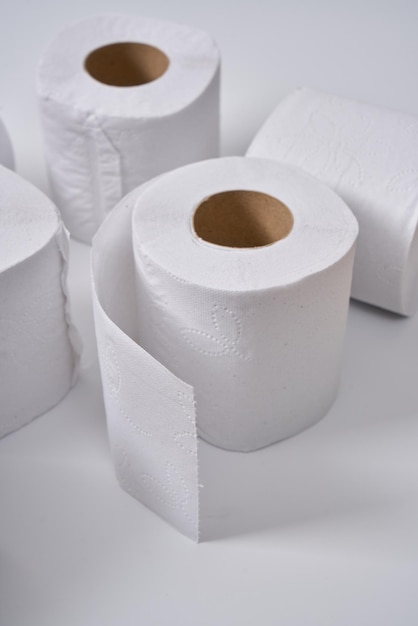
Where is `toilet paper rolls`? The image size is (418, 626). toilet paper rolls is located at coordinates (395, 207), (271, 280), (79, 185), (29, 258).